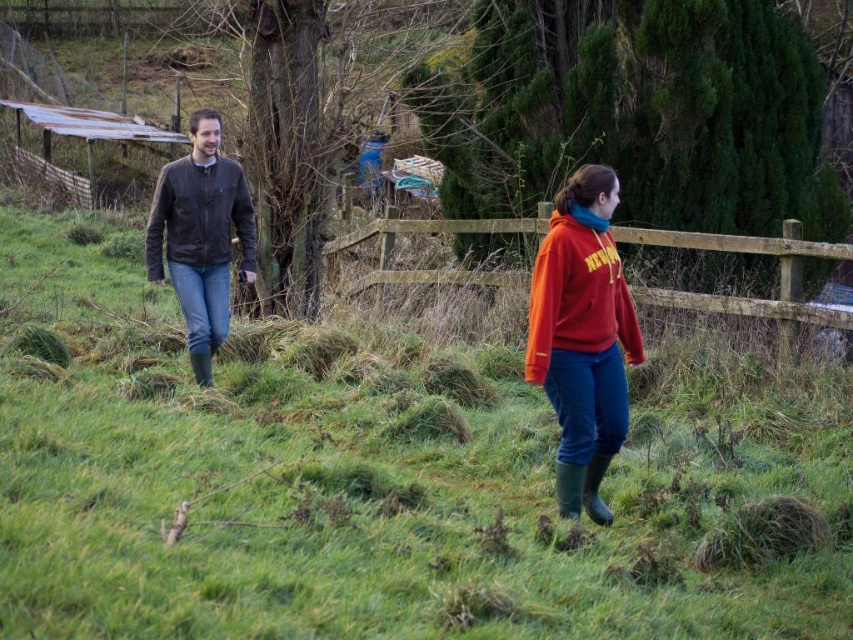
From the picture: Can you confirm if green grassy at center is positioned to the left of matte red sweatshirt at center?

Yes, green grassy at center is to the left of matte red sweatshirt at center.

Does point (815, 442) lie behind point (589, 353)?

Yes, it is.

You are a GUI agent. You are given a task and a screenshot of the screen. Output one action in this format:
    pyautogui.click(x=<x>, y=<y>)
    Task: Click on the green grassy at center
    This screenshot has height=640, width=853.
    Given the screenshot: What is the action you would take?
    pyautogui.click(x=386, y=477)

Does matte red hoodie at center have a lesser height compared to brown leather jacket at left?

No, matte red hoodie at center is not shorter than brown leather jacket at left.

Which of these two, matte red hoodie at center or brown leather jacket at left, stands taller?

matte red hoodie at center is taller.

The width and height of the screenshot is (853, 640). What do you see at coordinates (582, 337) in the screenshot?
I see `matte red hoodie at center` at bounding box center [582, 337].

Identify the location of matte red hoodie at center. The width and height of the screenshot is (853, 640). (582, 337).

Can you confirm if green grassy at center is bigger than leather jacket at left?

Indeed, green grassy at center has a larger size compared to leather jacket at left.

Does point (47, 550) lie in front of point (155, 250)?

Yes, point (47, 550) is in front of point (155, 250).

Between point (526, 392) and point (209, 132), which one is positioned in front?

Positioned in front is point (209, 132).

In order to click on green grassy at center in this screenshot , I will do `click(386, 477)`.